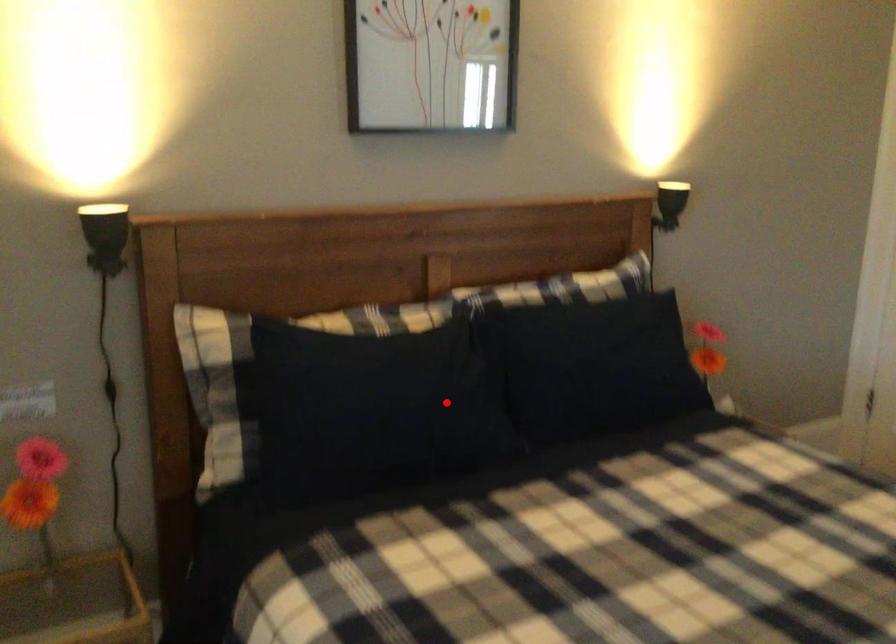
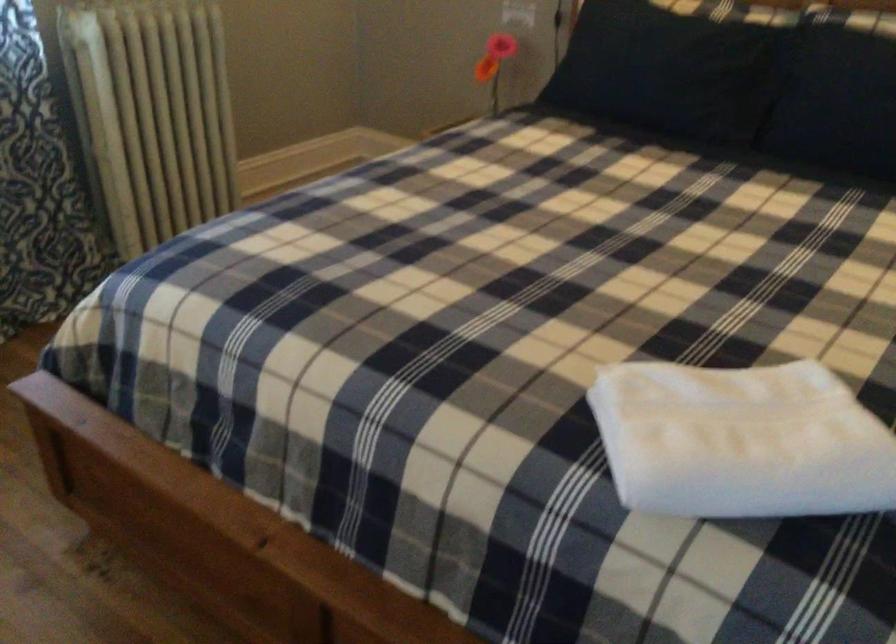
Question: I am providing you with two images of the same scene from different viewpoints. Given a red point in image1, look at the same physical point in image2. Is it:

Choices:
 (A) Closer to the viewpoint
 (B) Farther from the viewpoint

Answer: (B)